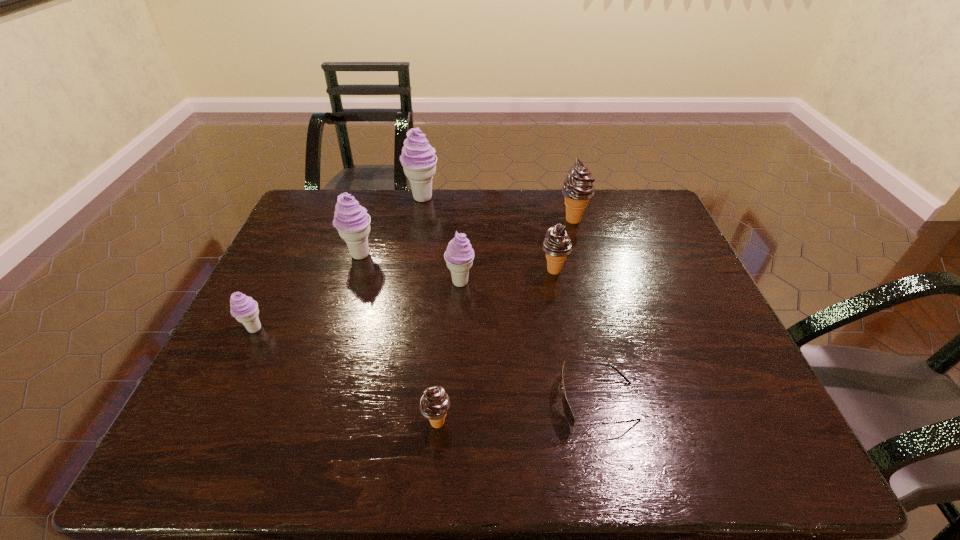
Identify the location of the second purple icecream from right to left. (418, 158).

Locate an element on the screen. the farthest purple icecream is located at coordinates (418, 158).

The width and height of the screenshot is (960, 540). In order to click on the sixth icecream from right to left in this screenshot , I will do `click(351, 220)`.

Identify the location of the second purple icecream from left to right. The height and width of the screenshot is (540, 960). (351, 220).

Find the location of `the sixth nearest icecream`. the sixth nearest icecream is located at coordinates (578, 188).

Find the location of a particular element. the seventh nearest object is located at coordinates (578, 188).

The height and width of the screenshot is (540, 960). In order to click on the second smallest chocolate icecream in this screenshot , I will do `click(557, 246)`.

Identify the location of the second nearest chocolate icecream. Image resolution: width=960 pixels, height=540 pixels. (557, 246).

Where is `the third farthest purple icecream`? the third farthest purple icecream is located at coordinates (459, 255).

At what (x,y) coordinates should I click in order to perform the action: click on the rightmost purple icecream. Please return your answer as a coordinate pair (x, y). The image size is (960, 540). Looking at the image, I should click on (459, 255).